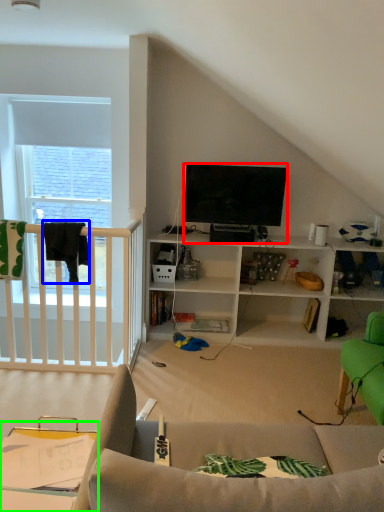
Question: Based on their relative distances, which object is nearer to television (highlighted by a red box)? Choose from clothesline (highlighted by a blue box) and table (highlighted by a green box).

Choices:
 (A) clothesline
 (B) table

Answer: (A)